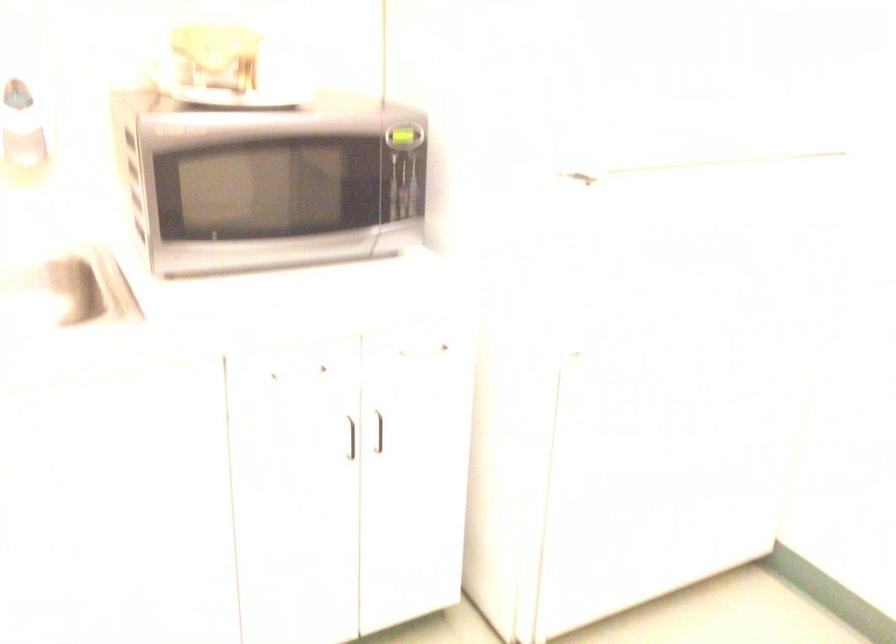
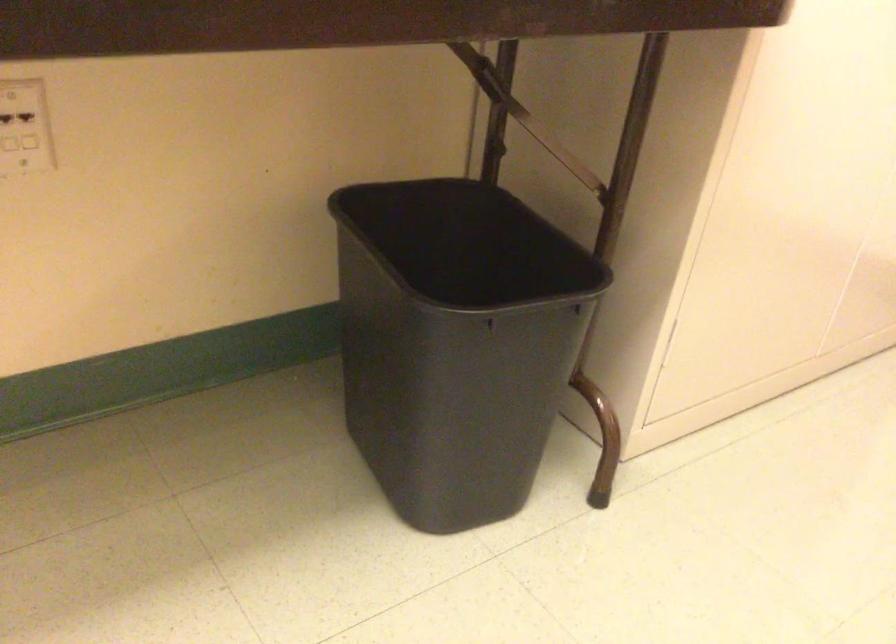
How did the camera likely rotate?

The camera's rotation is toward right-down.